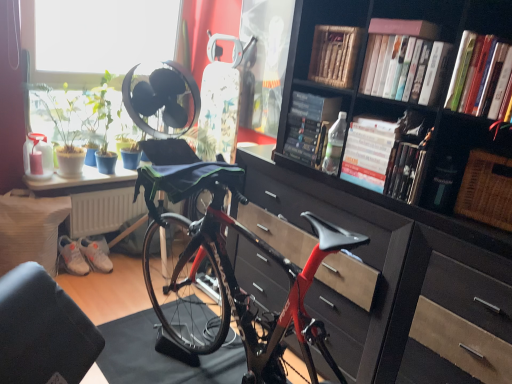
Image resolution: width=512 pixels, height=384 pixels. What do you see at coordinates (96, 253) in the screenshot?
I see `white matte sneakers at lower left, which ranks as the 1th sneakers in right-to-left order` at bounding box center [96, 253].

What do you see at coordinates (486, 190) in the screenshot? Image resolution: width=512 pixels, height=384 pixels. I see `woven brown picnic basket at right` at bounding box center [486, 190].

This screenshot has height=384, width=512. Describe the element at coordinates (405, 171) in the screenshot. I see `hardcover book at center, acting as the fourth book starting from the front` at that location.

This screenshot has height=384, width=512. Describe the element at coordinates (78, 121) in the screenshot. I see `green leafy plant at window` at that location.

At what (x,y) coordinates should I click in order to perform the action: click on green leafy plant at window. Please return your answer as a coordinate pair (x, y). Image resolution: width=512 pixels, height=384 pixels. Looking at the image, I should click on (78, 121).

In order to face wooden book at upper center, positioned as the second book in back-to-front order, should I rotate leftwards or rightwards?

Turn right by 11.598 degrees to look at wooden book at upper center, positioned as the second book in back-to-front order.

Measure the distance between green matte plant at upper left and camera.

green matte plant at upper left is 8.96 feet away from camera.

In order to click on white matte sneakers at lower left, which appears as the 2th sneakers when viewed from the left in this screenshot , I will do click(96, 253).

Measure the distance from white matte sneakers at lower left, which ranks as the 1th sneakers in right-to-left order, to hardcover book at upper center, the 3th book in the back-to-front sequence.

The distance of white matte sneakers at lower left, which ranks as the 1th sneakers in right-to-left order, from hardcover book at upper center, the 3th book in the back-to-front sequence, is 5.83 feet.

Who is bigger, white matte sneakers at lower left, which ranks as the 1th sneakers in right-to-left order, or hardcover book at upper center, which appears as the 5th book when viewed from the front?

Bigger between the two is hardcover book at upper center, which appears as the 5th book when viewed from the front.

From a real-world perspective, which object rests below the other?

In real-world perspective, white matte sneakers at lower left, which ranks as the 1th sneakers in right-to-left order, is lower.

Based on the photo, between white matte sneakers at lower left, which appears as the 2th sneakers when viewed from the left, and hardcover book at upper center, which appears as the 5th book when viewed from the front, which one has less height?

With less height is white matte sneakers at lower left, which appears as the 2th sneakers when viewed from the left.

From the image's perspective, between matte black chest of drawers at center and white matte sneakers at lower left, which is the 1th sneakers from left to right, who is located below?

matte black chest of drawers at center appears lower in the image.

Who is smaller, matte black chest of drawers at center or white matte sneakers at lower left, which is the 1th sneakers from left to right?

white matte sneakers at lower left, which is the 1th sneakers from left to right.

Between matte black chest of drawers at center and white matte sneakers at lower left, arranged as the second sneakers when viewed from the right, which one is positioned behind?

white matte sneakers at lower left, arranged as the second sneakers when viewed from the right, is more distant.

Is matte black chest of drawers at center aimed at white matte sneakers at lower left, which is the 1th sneakers from left to right?

No, matte black chest of drawers at center does not turn towards white matte sneakers at lower left, which is the 1th sneakers from left to right.

Does wooden book at upper center, which appears as the sixth book when viewed from the front, have a smaller size compared to hardcover book at center, which ranks as the fourth book in back-to-front order?

Incorrect, wooden book at upper center, which appears as the sixth book when viewed from the front, is not smaller in size than hardcover book at center, which ranks as the fourth book in back-to-front order.

Based on the photo, from the image's perspective, is wooden book at upper center, which appears as the sixth book when viewed from the front, located above or below hardcover book at center, acting as the fourth book starting from the front?

From the image's perspective, wooden book at upper center, which appears as the sixth book when viewed from the front, appears above hardcover book at center, acting as the fourth book starting from the front.

From a real-world perspective, is wooden book at upper center, positioned as the second book in back-to-front order, physically above hardcover book at center, acting as the fourth book starting from the front?

Indeed, from a real-world perspective, wooden book at upper center, positioned as the second book in back-to-front order, stands above hardcover book at center, acting as the fourth book starting from the front.

Between wooden book at upper center, positioned as the second book in back-to-front order, and hardcover book at center, acting as the fourth book starting from the front, which one appears on the left side from the viewer's perspective?

Positioned to the left is wooden book at upper center, positioned as the second book in back-to-front order.

Which point is more forward, (388, 186) or (455, 211)?

Point (455, 211)

The image size is (512, 384). I want to click on the 2nd book to the left of the woven brown picnic basket at right, counting from the anchor's position, so click(405, 171).

Looking at this image, from the image's perspective, is hardcover book at center, acting as the fourth book starting from the front, above or below woven brown picnic basket at right?

From the image's perspective, hardcover book at center, acting as the fourth book starting from the front, appears above woven brown picnic basket at right.

What's the angular difference between hardcover book at center, which ranks as the fourth book in back-to-front order, and woven brown picnic basket at right's facing directions?

There is a 4.47-degree angle between the facing directions of hardcover book at center, which ranks as the fourth book in back-to-front order, and woven brown picnic basket at right.

Is wooden book at upper center, which appears as the sixth book when viewed from the front, smaller than hardcover book at center, the 7th book in the front-to-back sequence?

Yes, wooden book at upper center, which appears as the sixth book when viewed from the front, is smaller than hardcover book at center, the 7th book in the front-to-back sequence.

Is hardcover book at center, the 7th book in the front-to-back sequence, at the back of wooden book at upper center, positioned as the second book in back-to-front order?

That's not correct — wooden book at upper center, positioned as the second book in back-to-front order, is not looking away from hardcover book at center, the 7th book in the front-to-back sequence.

How different are the orientations of wooden book at upper center, positioned as the second book in back-to-front order, and hardcover book at center, the 1th book when ordered from back to front, in degrees?

4.94 degrees.

Which object is thinner, wooden book at upper center, positioned as the second book in back-to-front order, or hardcover book at center, the 1th book when ordered from back to front?

With smaller width is wooden book at upper center, positioned as the second book in back-to-front order.

Can you confirm if white matte book at upper center, placed as the 2th book when sorted from front to back, is smaller than matte black table at lower left?

Correct, white matte book at upper center, placed as the 2th book when sorted from front to back, occupies less space than matte black table at lower left.

Is white matte book at upper center, placed as the 2th book when sorted from front to back, not near matte black table at lower left?

Yes.

Considering the points (375, 45) and (27, 180), which point is behind, point (375, 45) or point (27, 180)?

The point (27, 180) is farther from the camera.

Is green leafy plant at window wider than white matte sneakers at lower left, which is the 1th sneakers from left to right?

Yes, green leafy plant at window is wider than white matte sneakers at lower left, which is the 1th sneakers from left to right.

Can you confirm if green leafy plant at window is positioned to the right of white matte sneakers at lower left, which is the 1th sneakers from left to right?

Indeed, green leafy plant at window is positioned on the right side of white matte sneakers at lower left, which is the 1th sneakers from left to right.

Which of these two, green leafy plant at window or white matte sneakers at lower left, arranged as the second sneakers when viewed from the right, stands taller?

With more height is green leafy plant at window.

Can you confirm if green leafy plant at window is bigger than white matte sneakers at lower left, arranged as the second sneakers when viewed from the right?

Yes.

Identify the location of the 2nd sneakers below the hardcover book at upper center, which appears as the 5th book when viewed from the front (from a real-world perspective). The width and height of the screenshot is (512, 384). (96, 253).

This screenshot has width=512, height=384. What are the coordinates of `the chest of drawers in front of the white matte sneakers at lower left, arranged as the second sneakers when viewed from the right` in the screenshot? It's located at (335, 260).

Estimate the real-world distances between objects in this image. Which object is further from green leafy plant at window, matte black table at lower left or wooden book at upper center, positioned as the second book in back-to-front order?

The object further to green leafy plant at window is wooden book at upper center, positioned as the second book in back-to-front order.

Considering their positions, is green matte plant at upper left positioned further to white matte sneakers at lower left, which is the 1th sneakers from left to right, than hardcover book at upper right, which appears as the 1th book when viewed from the front?

The object further to white matte sneakers at lower left, which is the 1th sneakers from left to right, is hardcover book at upper right, which appears as the 1th book when viewed from the front.

Which object lies further to the anchor point green leafy plant at window, white matte sneakers at lower left, which appears as the 2th sneakers when viewed from the left, or green matte plant at upper left?

The object further to green leafy plant at window is white matte sneakers at lower left, which appears as the 2th sneakers when viewed from the left.

Which object lies nearer to the anchor point white matte sneakers at lower left, which appears as the 2th sneakers when viewed from the left, pink matte book at upper center, acting as the 5th book starting from the back, or hardcover book at center, the 1th book when ordered from back to front?

Based on the image, hardcover book at center, the 1th book when ordered from back to front, appears to be nearer to white matte sneakers at lower left, which appears as the 2th sneakers when viewed from the left.

Which object lies further to the anchor point wooden book at upper center, positioned as the second book in back-to-front order, woven brown picnic basket at right or hardcover book at center, acting as the fourth book starting from the front?

woven brown picnic basket at right is further to wooden book at upper center, positioned as the second book in back-to-front order.

Looking at the image, which one is located closer to white matte book at upper center, the sixth book positioned from the back, matte black table at lower left or green leafy plant at window?

green leafy plant at window.

Consider the image. Looking at the image, which one is located closer to green matte plant at upper left, matte black table at lower left or white matte sneakers at lower left, which is the 1th sneakers from left to right?

matte black table at lower left is positioned closer to the anchor green matte plant at upper left.

Looking at the image, which one is located further to wooden book at upper center, positioned as the second book in back-to-front order, hardcover book at center, acting as the fourth book starting from the front, or white matte sneakers at lower left, which is the 1th sneakers from left to right?

Based on the image, white matte sneakers at lower left, which is the 1th sneakers from left to right, appears to be further to wooden book at upper center, positioned as the second book in back-to-front order.

Where is `book between white matte sneakers at lower left, which is the 1th sneakers from left to right, and wooden book at upper center, positioned as the second book in back-to-front order, from left to right`? book between white matte sneakers at lower left, which is the 1th sneakers from left to right, and wooden book at upper center, positioned as the second book in back-to-front order, from left to right is located at coordinates (310, 127).

You are a GUI agent. You are given a task and a screenshot of the screen. Output one action in this format:
    pyautogui.click(x=<x>, y=<y>)
    Task: Click on the plant between white matte sneakers at lower left, which appears as the 2th sneakers when viewed from the left, and hardcover book at center, which ranks as the fourth book in back-to-front order, from left to right
    The width and height of the screenshot is (512, 384).
    Given the screenshot: What is the action you would take?
    pyautogui.click(x=100, y=114)

Locate an element on the screen. table between white matte sneakers at lower left, which is the 1th sneakers from left to right, and pink matte book at upper center, acting as the 5th book starting from the back, in the horizontal direction is located at coordinates (81, 178).

Where is `picnic basket between hardcover book at center, which ranks as the fourth book in back-to-front order, and matte black chest of drawers at center in the up-down direction`? picnic basket between hardcover book at center, which ranks as the fourth book in back-to-front order, and matte black chest of drawers at center in the up-down direction is located at coordinates (486, 190).